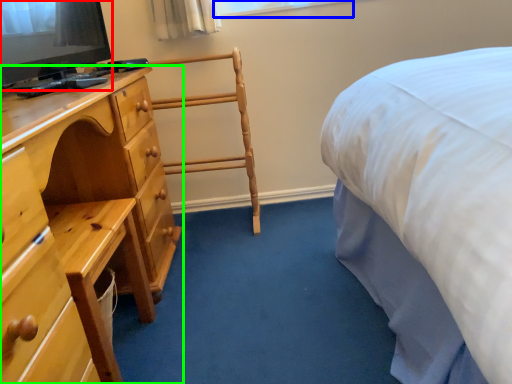
Question: Which is farther away from television (highlighted by a red box)? window (highlighted by a blue box) or chest of drawers (highlighted by a green box)?

Choices:
 (A) window
 (B) chest of drawers

Answer: (A)